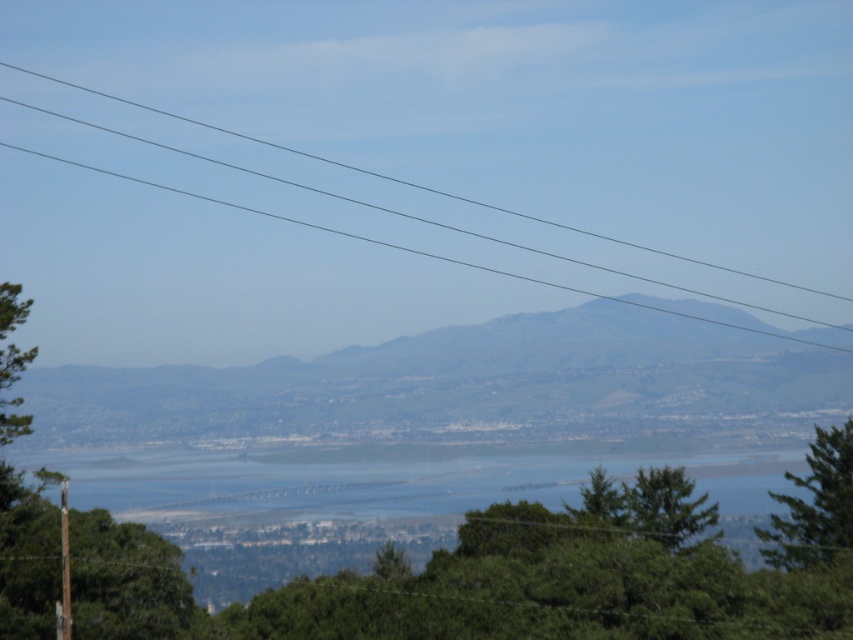
You are a bird flying over the coastal landscape. You want to land on the green leafy tree at center but first need to pass under the clear wire at upper center. Can you safely pass under the wire without hitting it?

The clear wire at upper center and green leafy tree at center are 825.81 feet apart from each other, so the distance between them is sufficient for a bird to safely pass under the wire without hitting it.